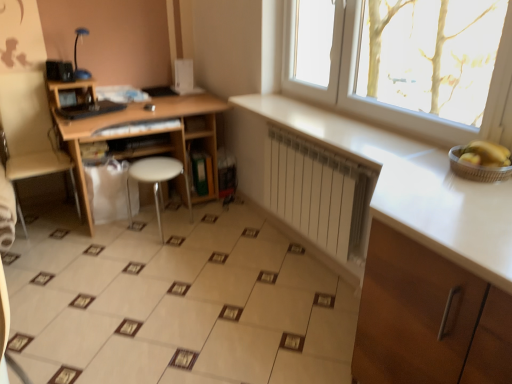
In order to click on free space in front of beige fabric swivel chair at left in this screenshot , I will do `click(42, 247)`.